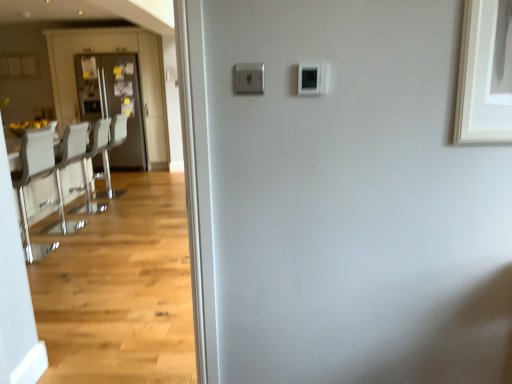
Identify the location of free spot to the right of white glossy armchair at left, placed as the 1th armchair when sorted from front to back. The height and width of the screenshot is (384, 512). (135, 205).